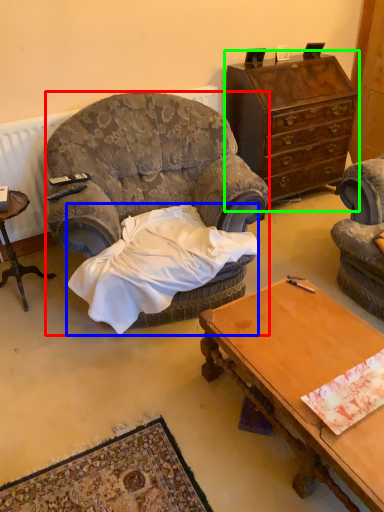
Question: Considering the real-world distances, which object is farthest from chair (highlighted by a red box)? blanket (highlighted by a blue box) or dresser (highlighted by a green box)?

Choices:
 (A) blanket
 (B) dresser

Answer: (B)